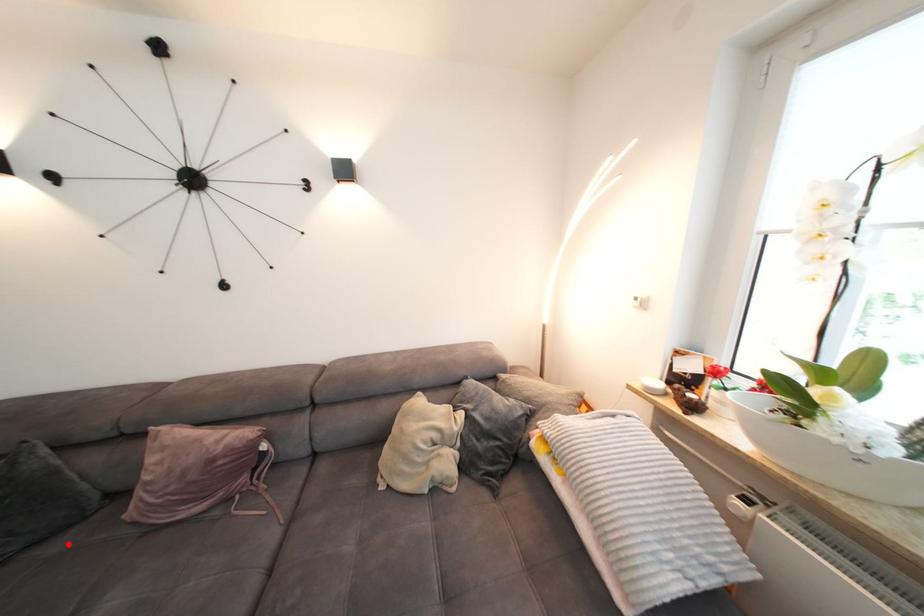
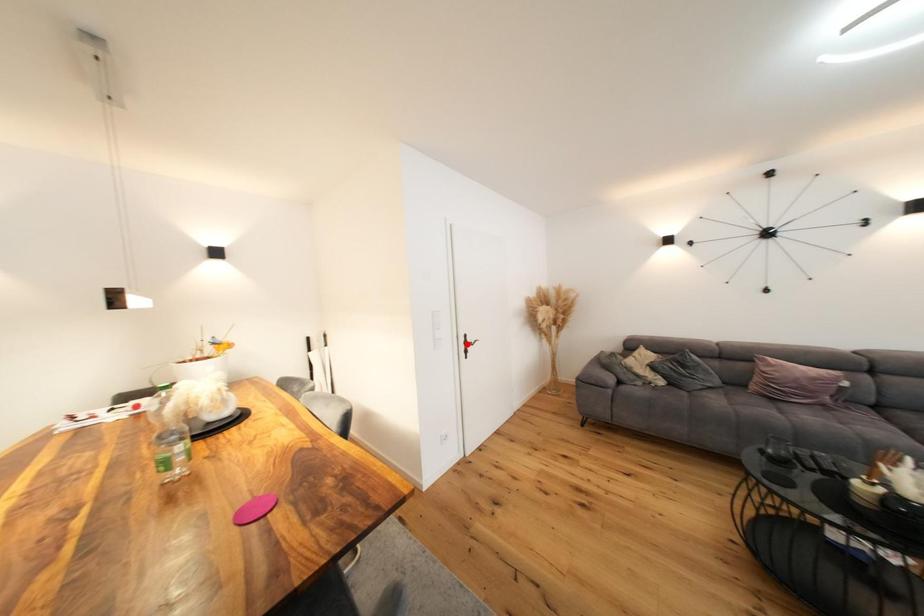
From the picture: I am providing you with two images of the same scene from different viewpoints. A red point is marked on the first image and another point is marked on the second image. Is the red point in image1 aligned with the point shown in image2?

No